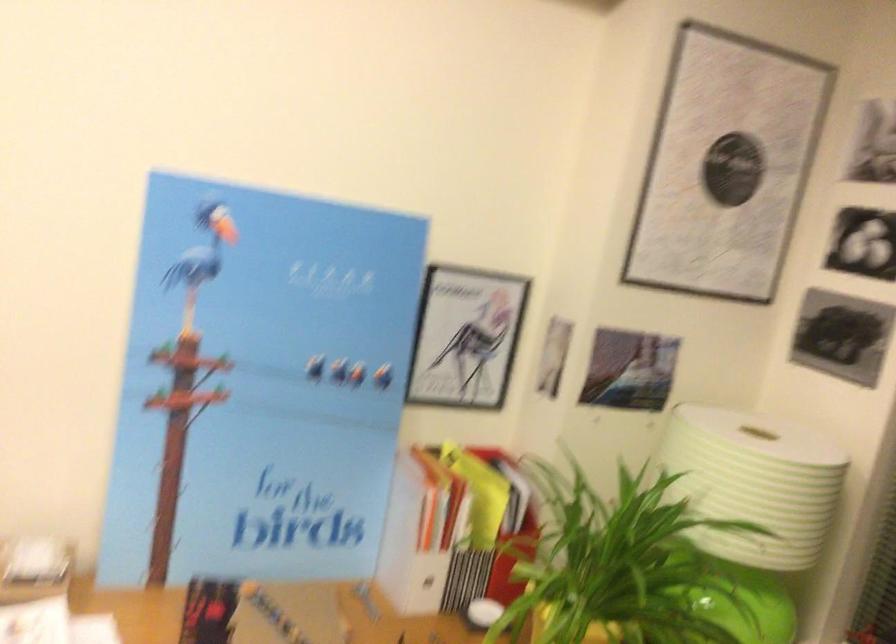
The image size is (896, 644). Describe the element at coordinates (470, 522) in the screenshot. I see `the striped file holder` at that location.